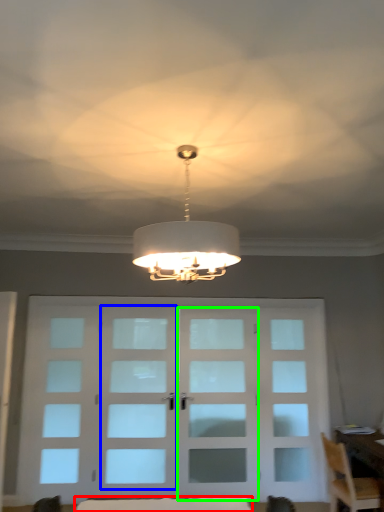
Question: Which object is the farthest from furniture (highlighted by a red box)? Choose among these: screen door (highlighted by a blue box) or screen door (highlighted by a green box).

Choices:
 (A) screen door
 (B) screen door

Answer: (A)